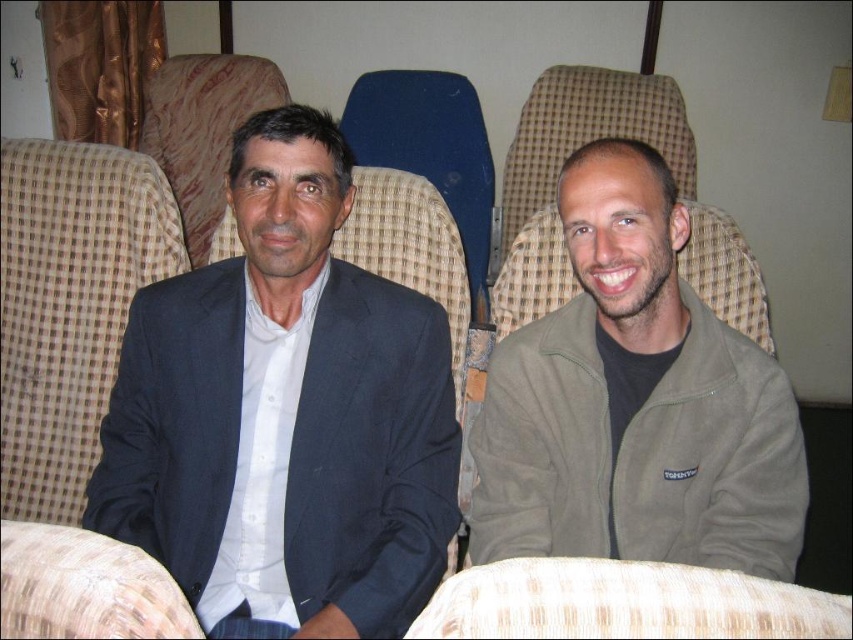
Between dark blue suit at center and matte green jacket at right, which one is positioned higher?

matte green jacket at right

Does dark blue suit at center appear on the right side of matte green jacket at right?

No, dark blue suit at center is not to the right of matte green jacket at right.

What do you see at coordinates (285, 412) in the screenshot? I see `dark blue suit at center` at bounding box center [285, 412].

In order to click on dark blue suit at center in this screenshot , I will do `click(285, 412)`.